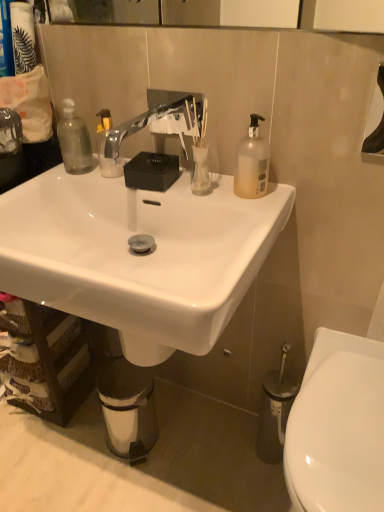
In order to click on free spot above white glossy toilet at lower right (from a real-world perspective) in this screenshot , I will do `click(344, 418)`.